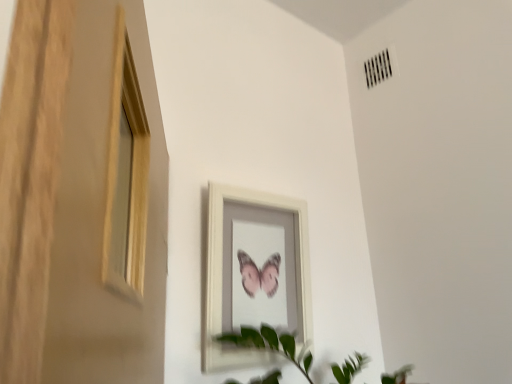
Describe the element at coordinates (222, 275) in the screenshot. I see `white wooden picture frame at center` at that location.

Find the location of a particular element. white wooden picture frame at center is located at coordinates (222, 275).

What is the approximate height of white wooden picture frame at center?

18.65 inches.

What is the approximate width of white wooden picture frame at center?

white wooden picture frame at center is 3.89 inches in width.

Image resolution: width=512 pixels, height=384 pixels. Identify the location of white wooden picture frame at center. (222, 275).